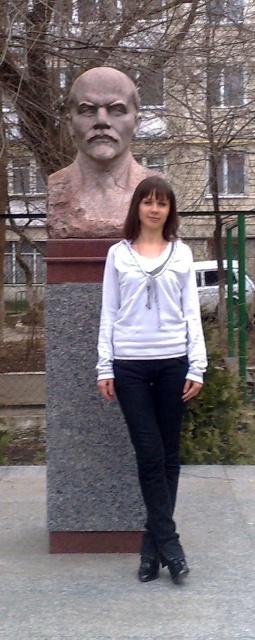
The woman in the image is wearing two white items of clothing. Which one is narrower in width between the white cotton hoodie at center and the white matte shirt at center?

The white cotton hoodie at center is narrower in width than the white matte shirt at center.

You are a photographer setting up for a portrait. You need to position the white cotton hoodie at center and the brown stone bust at center so that the hoodie is on the left side of the bust. Are they currently positioned correctly?

The white cotton hoodie at center is currently to the right of the brown stone bust at center, so they are not positioned correctly as the hoodie needs to be on the left side of the bust.